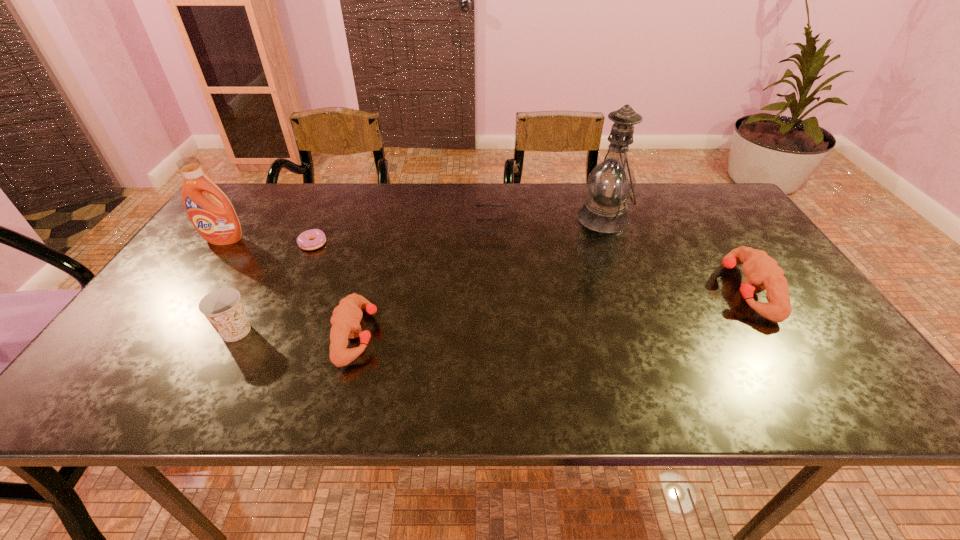
Where is `the shorter puncher`? The image size is (960, 540). the shorter puncher is located at coordinates (346, 318).

At what (x,y) coordinates should I click in order to perform the action: click on the fifth tallest object. Please return your answer as a coordinate pair (x, y). Image resolution: width=960 pixels, height=540 pixels. Looking at the image, I should click on (346, 318).

Where is `the taller puncher`? This screenshot has width=960, height=540. the taller puncher is located at coordinates (762, 272).

The height and width of the screenshot is (540, 960). Identify the location of the right puncher. (762, 272).

At what (x,y) coordinates should I click in order to perform the action: click on the fifth object from right to left. Please return your answer as a coordinate pair (x, y). Image resolution: width=960 pixels, height=540 pixels. Looking at the image, I should click on (304, 240).

Find the location of a particular element. The height and width of the screenshot is (540, 960). doughnut is located at coordinates (304, 240).

The height and width of the screenshot is (540, 960). I want to click on the tallest object, so (x=611, y=182).

Where is `oil lamp`? The image size is (960, 540). oil lamp is located at coordinates (611, 182).

Locate an element on the screen. The width and height of the screenshot is (960, 540). the third object from right to left is located at coordinates (477, 205).

Find the location of a particular element. The image size is (960, 540). the second shortest object is located at coordinates (477, 205).